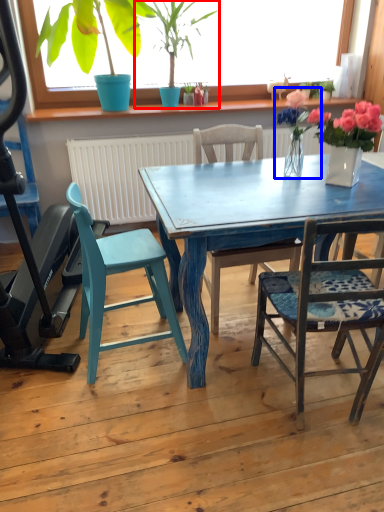
Question: Which object is closer to the camera taking this photo, houseplant (highlighted by a red box) or floral arrangement (highlighted by a blue box)?

Choices:
 (A) houseplant
 (B) floral arrangement

Answer: (B)